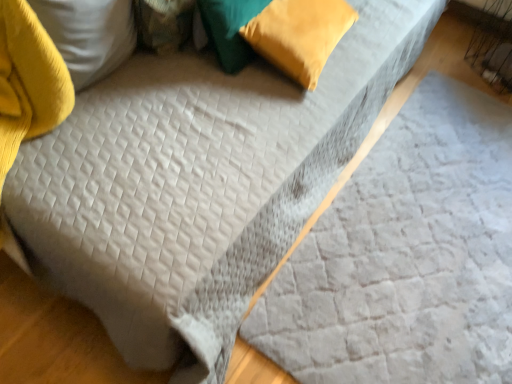
Question: Which direction should I rotate to face velvet green pillow at upper center, the second pillow positioned from the left, — up or down?

Choices:
 (A) down
 (B) up

Answer: (B)

Question: Does velvet green pillow at upper left, which ranks as the 3th pillow in right-to-left order, have a lesser width compared to velvet green pillow at upper center, the second pillow positioned from the left?

Choices:
 (A) yes
 (B) no

Answer: (B)

Question: Does velvet green pillow at upper left, which ranks as the 3th pillow in right-to-left order, have a larger size compared to velvet green pillow at upper center, the second pillow positioned from the left?

Choices:
 (A) no
 (B) yes

Answer: (A)

Question: Is velvet green pillow at upper left, which appears as the 1th pillow when viewed from the left, in front of velvet green pillow at upper center, the second pillow positioned from the left?

Choices:
 (A) yes
 (B) no

Answer: (A)

Question: Does velvet green pillow at upper left, which appears as the 1th pillow when viewed from the left, have a lesser height compared to velvet green pillow at upper center, which ranks as the second pillow in right-to-left order?

Choices:
 (A) yes
 (B) no

Answer: (A)

Question: Can you confirm if velvet green pillow at upper left, which ranks as the 3th pillow in right-to-left order, is positioned to the left of velvet green pillow at upper center, which ranks as the second pillow in right-to-left order?

Choices:
 (A) no
 (B) yes

Answer: (B)

Question: Is velvet green pillow at upper left, which ranks as the 3th pillow in right-to-left order, not within velvet green pillow at upper center, which ranks as the second pillow in right-to-left order?

Choices:
 (A) no
 (B) yes

Answer: (B)

Question: Is gray quilted sheet at center oriented towards velvet green pillow at upper left, which appears as the 1th pillow when viewed from the left?

Choices:
 (A) yes
 (B) no

Answer: (B)

Question: Would you say velvet green pillow at upper left, which appears as the 1th pillow when viewed from the left, is part of gray quilted sheet at center's contents?

Choices:
 (A) no
 (B) yes

Answer: (A)

Question: Is gray quilted sheet at center shorter than velvet green pillow at upper left, which ranks as the 3th pillow in right-to-left order?

Choices:
 (A) no
 (B) yes

Answer: (B)

Question: Is gray quilted sheet at center taller than velvet green pillow at upper left, which ranks as the 3th pillow in right-to-left order?

Choices:
 (A) yes
 (B) no

Answer: (B)

Question: Does gray quilted sheet at center appear on the right side of velvet green pillow at upper left, which appears as the 1th pillow when viewed from the left?

Choices:
 (A) no
 (B) yes

Answer: (B)

Question: Does gray quilted sheet at center lie in front of velvet green pillow at upper left, which appears as the 1th pillow when viewed from the left?

Choices:
 (A) yes
 (B) no

Answer: (A)

Question: Is gray quilted sheet at center smaller than velvet green pillow at upper center, the second pillow positioned from the left?

Choices:
 (A) yes
 (B) no

Answer: (B)